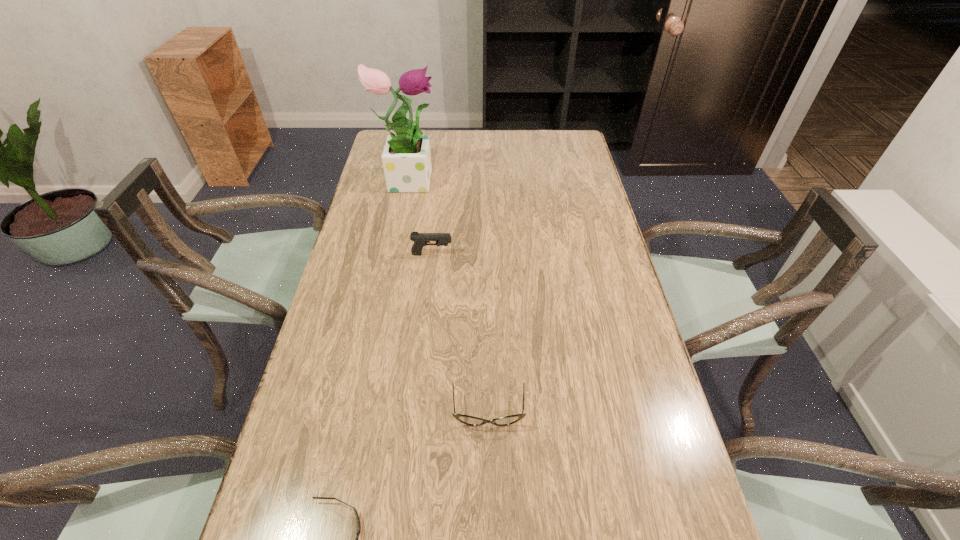
Locate an element on the screen. The height and width of the screenshot is (540, 960). vacant space at the far edge of the desktop is located at coordinates (522, 142).

The image size is (960, 540). In order to click on free location at the left edge of the desktop in this screenshot , I will do `click(396, 206)`.

Image resolution: width=960 pixels, height=540 pixels. Find the location of `free spot at the right edge of the desktop`. free spot at the right edge of the desktop is located at coordinates (549, 175).

Where is `vacant space that's between the tallest object and the spectacles`? This screenshot has height=540, width=960. vacant space that's between the tallest object and the spectacles is located at coordinates (448, 295).

What are the coordinates of `free spot between the pistol and the flower arrangement` in the screenshot? It's located at click(420, 217).

Locate an element on the screen. vacant area between the pistol and the spectacles is located at coordinates (460, 333).

Identify the location of object that stands as the third closest to the farthest object. The height and width of the screenshot is (540, 960). (358, 532).

Select which object appears as the second closest to the third farthest object. Please provide its 2D coordinates. Your answer should be formatted as a tuple, i.e. [(x, y)], where the tuple contains the x and y coordinates of a point satisfying the conditions above.

[(420, 239)]